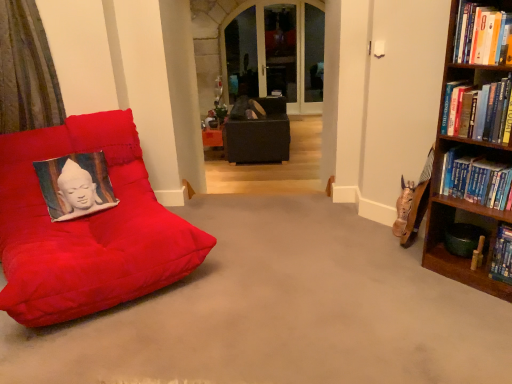
Question: Is matte black bean bag at center positioned beyond the bounds of suede red beanbag at left?

Choices:
 (A) no
 (B) yes

Answer: (B)

Question: Is matte black bean bag at center positioned behind suede red beanbag at left?

Choices:
 (A) no
 (B) yes

Answer: (B)

Question: Is matte black bean bag at center to the left of suede red beanbag at left from the viewer's perspective?

Choices:
 (A) no
 (B) yes

Answer: (A)

Question: Does matte black bean bag at center touch suede red beanbag at left?

Choices:
 (A) yes
 (B) no

Answer: (B)

Question: Is matte black bean bag at center thinner than suede red beanbag at left?

Choices:
 (A) no
 (B) yes

Answer: (B)

Question: Does matte black bean bag at center have a greater width compared to suede red beanbag at left?

Choices:
 (A) yes
 (B) no

Answer: (B)

Question: Is hardcover book at upper right, arranged as the first book when viewed from the top, directly adjacent to matte black bean bag at center?

Choices:
 (A) yes
 (B) no

Answer: (B)

Question: Does hardcover book at upper right, arranged as the first book when viewed from the top, have a lesser height compared to matte black bean bag at center?

Choices:
 (A) no
 (B) yes

Answer: (B)

Question: Considering the relative sizes of hardcover book at upper right, acting as the 3th book starting from the bottom, and matte black bean bag at center in the image provided, is hardcover book at upper right, acting as the 3th book starting from the bottom, taller than matte black bean bag at center?

Choices:
 (A) no
 (B) yes

Answer: (A)

Question: Is hardcover book at upper right, arranged as the first book when viewed from the top, bigger than matte black bean bag at center?

Choices:
 (A) no
 (B) yes

Answer: (A)

Question: Does hardcover book at upper right, arranged as the first book when viewed from the top, have a greater width compared to matte black bean bag at center?

Choices:
 (A) yes
 (B) no

Answer: (B)

Question: Is hardcover book at upper right, arranged as the first book when viewed from the top, positioned far away from matte black bean bag at center?

Choices:
 (A) no
 (B) yes

Answer: (B)

Question: Is textured fabric pillow at left thinner than hardcover book at upper right, arranged as the 2th book when viewed from the top?

Choices:
 (A) yes
 (B) no

Answer: (A)